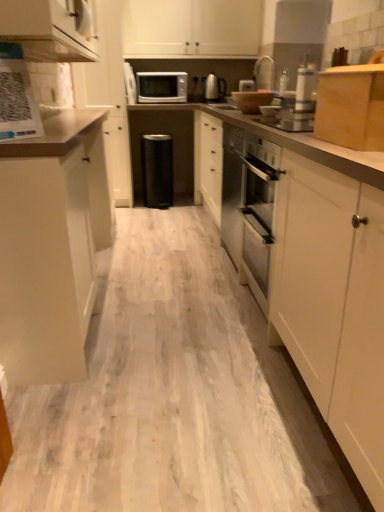
I want to click on vacant area that is in front of matte white cabinet at left, acting as the third cabinetry starting from the right, so click(158, 389).